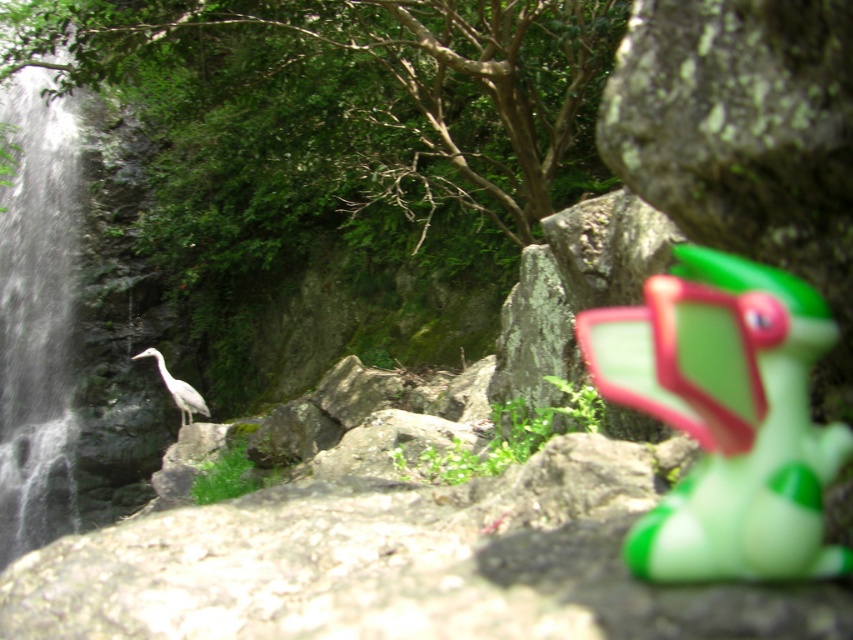
Question: Among these objects, which one is farthest from the camera?

Choices:
 (A) green rubber toy at right
 (B) gray matte bird at center

Answer: (B)

Question: Which of the following is the closest to the observer?

Choices:
 (A) (822, 339)
 (B) (169, 387)

Answer: (A)

Question: Is green rubber toy at right smaller than gray matte bird at center?

Choices:
 (A) no
 (B) yes

Answer: (B)

Question: From the image, what is the correct spatial relationship of green rubber toy at right in relation to gray matte bird at center?

Choices:
 (A) below
 (B) above

Answer: (B)

Question: Can you confirm if green rubber toy at right is bigger than gray matte bird at center?

Choices:
 (A) no
 (B) yes

Answer: (A)